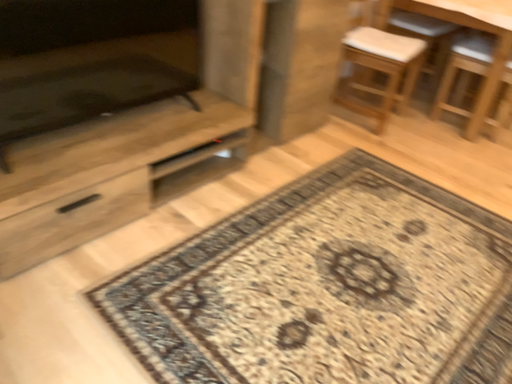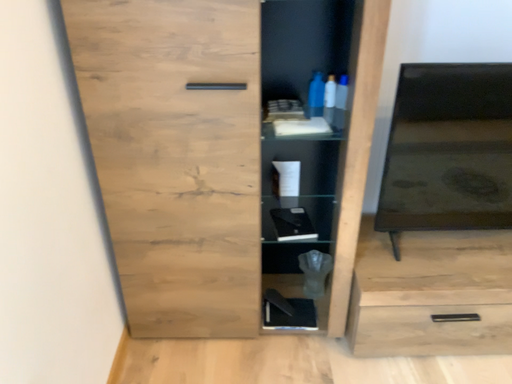
Question: Which way did the camera rotate in the video?

Choices:
 (A) rotated right
 (B) rotated left

Answer: (B)